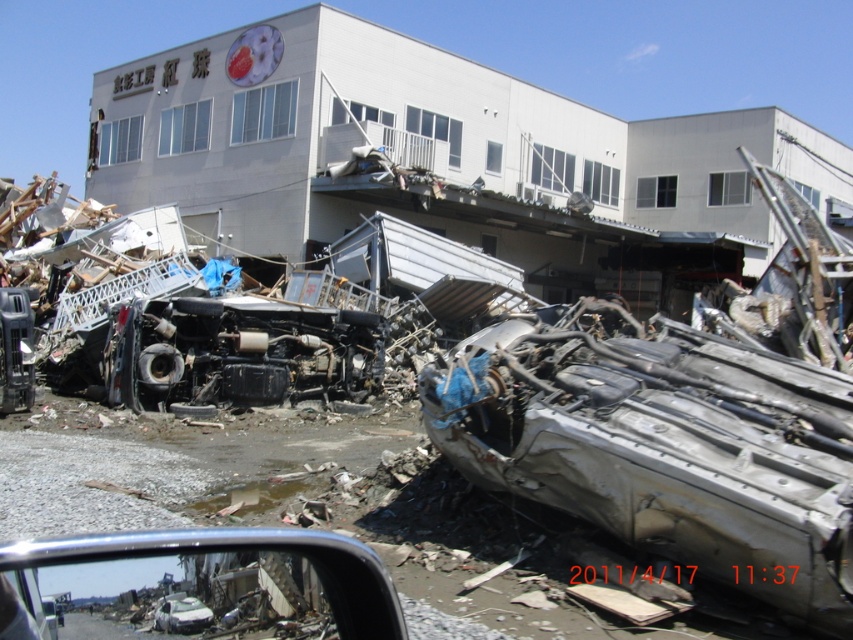
Question: Is rusty metallic car at center wider than silver metallic car at center?

Choices:
 (A) no
 (B) yes

Answer: (B)

Question: Can you confirm if rusty metallic car at center is thinner than silver metallic car at center?

Choices:
 (A) yes
 (B) no

Answer: (B)

Question: Which point is farther to the camera?

Choices:
 (A) rusty metallic car at center
 (B) silver metallic car at center

Answer: (A)

Question: Can you confirm if rusty metallic car at center is smaller than silver metallic car at center?

Choices:
 (A) no
 (B) yes

Answer: (A)